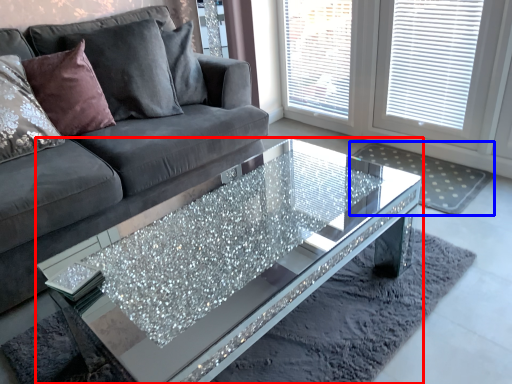
Question: Which point is further to the camera, coffee table (highlighted by a red box) or mat (highlighted by a blue box)?

Choices:
 (A) coffee table
 (B) mat

Answer: (B)